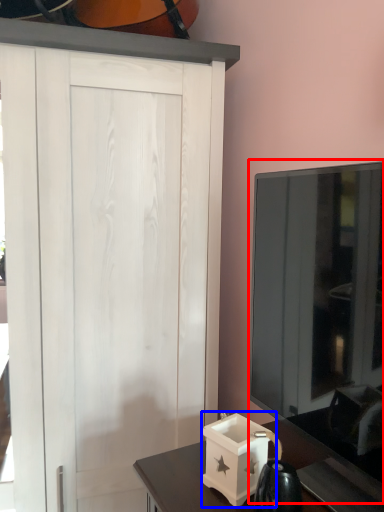
Question: Which of the following is the farthest to the observer, glass door (highlighted by a red box) or box (highlighted by a blue box)?

Choices:
 (A) glass door
 (B) box

Answer: (B)